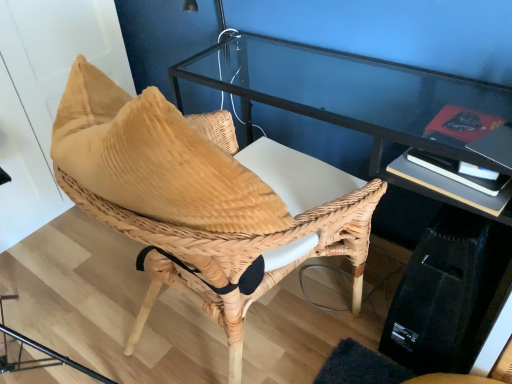
This screenshot has height=384, width=512. Describe the element at coordinates (192, 202) in the screenshot. I see `natural woven chair at center` at that location.

Locate an element on the screen. Image resolution: width=512 pixels, height=384 pixels. natural woven chair at center is located at coordinates (192, 202).

In the scene shown: What is the approximate height of natural woven chair at center?

natural woven chair at center is 30.99 inches in height.

Locate an element on the screen. natural woven chair at center is located at coordinates (192, 202).